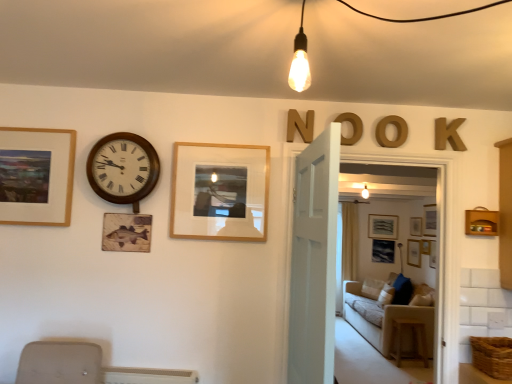
Question: Can you confirm if transparent glass door at center is wider than brown woven basket at lower right?

Choices:
 (A) no
 (B) yes

Answer: (A)

Question: Is transparent glass door at center thinner than brown woven basket at lower right?

Choices:
 (A) no
 (B) yes

Answer: (B)

Question: Is brown woven basket at lower right completely or partially inside transparent glass door at center?

Choices:
 (A) no
 (B) yes

Answer: (A)

Question: Is transparent glass door at center not inside brown woven basket at lower right?

Choices:
 (A) no
 (B) yes

Answer: (B)

Question: From a real-world perspective, is transparent glass door at center beneath brown woven basket at lower right?

Choices:
 (A) yes
 (B) no

Answer: (B)

Question: Is transparent glass door at center smaller than brown woven basket at lower right?

Choices:
 (A) yes
 (B) no

Answer: (B)

Question: Considering the relative sizes of gold metallic letter o at upper center, the second letter in the right-to-left sequence, and matte gray picture frame at center, placed as the 4th picture frame when sorted from front to back, in the image provided, is gold metallic letter o at upper center, the second letter in the right-to-left sequence, smaller than matte gray picture frame at center, placed as the 4th picture frame when sorted from front to back,?

Choices:
 (A) no
 (B) yes

Answer: (B)

Question: Does gold metallic letter o at upper center, the second letter in the right-to-left sequence, have a greater width compared to matte gray picture frame at center, the first picture frame positioned from the right?

Choices:
 (A) yes
 (B) no

Answer: (A)

Question: Is gold metallic letter o at upper center, which is the 3th letter in left-to-right order, further to camera compared to matte gray picture frame at center, the first picture frame positioned from the right?

Choices:
 (A) yes
 (B) no

Answer: (B)

Question: Is gold metallic letter o at upper center, which is the 3th letter in left-to-right order, positioned in front of matte gray picture frame at center, the first picture frame positioned from the right?

Choices:
 (A) yes
 (B) no

Answer: (A)

Question: From a real-world perspective, is gold metallic letter o at upper center, the second letter in the right-to-left sequence, below matte gray picture frame at center, the third picture frame when ordered from top to bottom?

Choices:
 (A) no
 (B) yes

Answer: (A)

Question: Is gold metallic letter o at upper center, the second letter in the right-to-left sequence, to the left of matte gray picture frame at center, the third picture frame when ordered from top to bottom, from the viewer's perspective?

Choices:
 (A) yes
 (B) no

Answer: (A)

Question: Is wooden at right surrounding wooden frame at center, which is the second picture frame in left-to-right order?

Choices:
 (A) yes
 (B) no

Answer: (B)